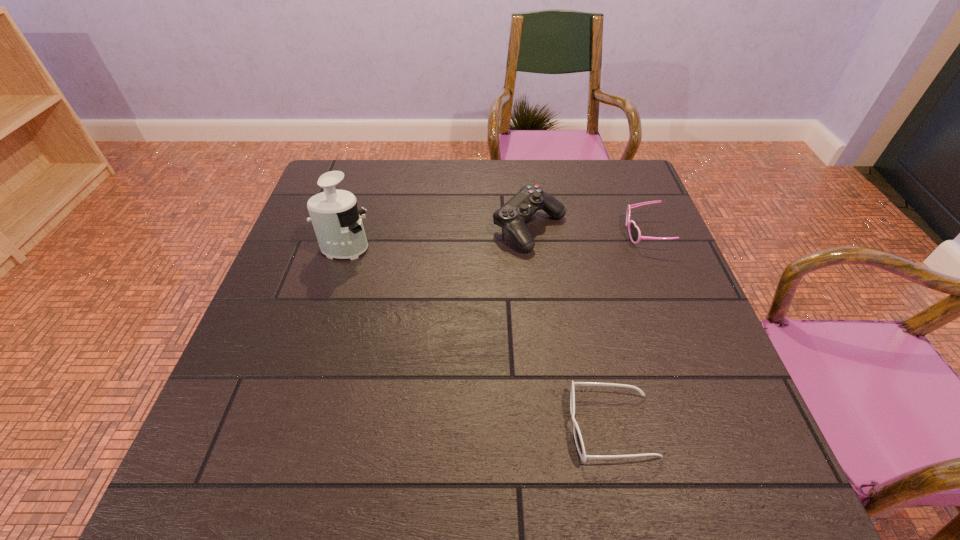
Find the location of a particular element. The width and height of the screenshot is (960, 540). vacant region located on the front-facing side of the rightmost object is located at coordinates (498, 234).

This screenshot has height=540, width=960. In order to click on vacant region located on the front-facing side of the rightmost object in this screenshot , I will do `click(602, 234)`.

Identify the location of vacant position located with the lenses of the shortest object facing outward. (428, 426).

You are a GUI agent. You are given a task and a screenshot of the screen. Output one action in this format:
    pyautogui.click(x=<x>, y=<y>)
    Task: Click on the vacant space located with the lenses of the shortest object facing outward
    
    Given the screenshot: What is the action you would take?
    pyautogui.click(x=483, y=426)

Identify the location of vacant space located with the lenses of the shortest object facing outward. (373, 426).

Find the location of a particular element. object located at the far edge is located at coordinates (512, 216).

Identify the location of object situated at the near edge. This screenshot has width=960, height=540. (577, 434).

Find the location of `object at the left edge`. object at the left edge is located at coordinates (337, 223).

Locate an element on the screen. This screenshot has width=960, height=540. object present at the right edge is located at coordinates (634, 232).

Image resolution: width=960 pixels, height=540 pixels. Find the location of `free space at the far edge`. free space at the far edge is located at coordinates (409, 184).